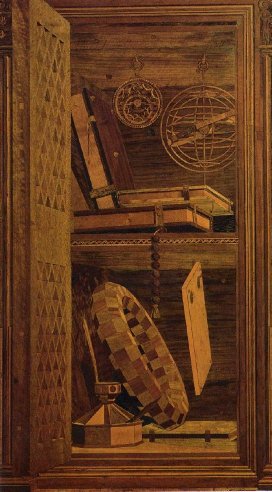
Where is `frame`? frame is located at coordinates (250, 92).